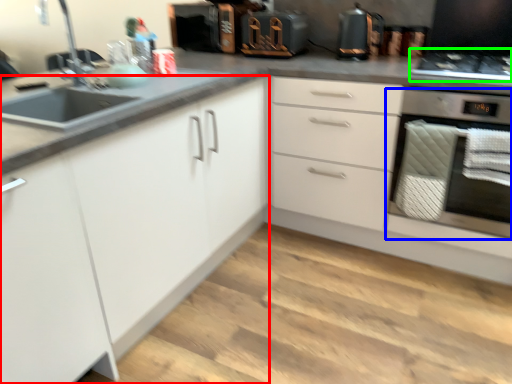
Question: Which is farther away from cabinetry (highlighted by a red box)? home appliance (highlighted by a blue box) or gas stove (highlighted by a green box)?

Choices:
 (A) home appliance
 (B) gas stove

Answer: (B)